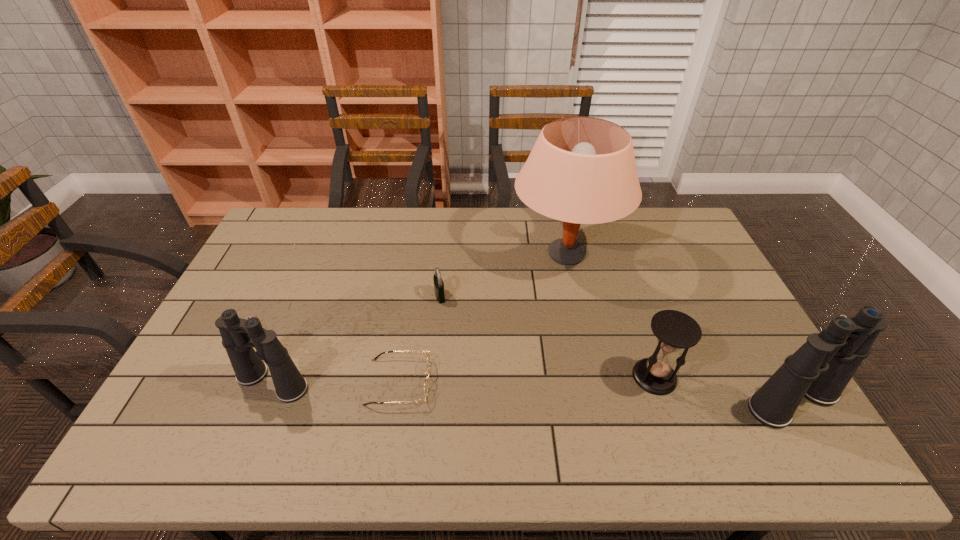
This screenshot has height=540, width=960. I want to click on free point that satisfies the following two spatial constraints: 1. on the front-facing side of the tallest object; 2. on the right side of the third shortest object, so click(x=593, y=377).

Image resolution: width=960 pixels, height=540 pixels. I want to click on vacant area in the image that satisfies the following two spatial constraints: 1. on the front side of the shorter binoculars; 2. on the left side of the fifth shortest object, so click(265, 401).

I want to click on vacant space that satisfies the following two spatial constraints: 1. on the back side of the rightmost object; 2. on the lenses of the shortest object, so click(x=781, y=382).

Locate an element on the screen. This screenshot has width=960, height=540. vacant point that satisfies the following two spatial constraints: 1. on the front-facing side of the tallest object; 2. on the back side of the second tallest object is located at coordinates (598, 401).